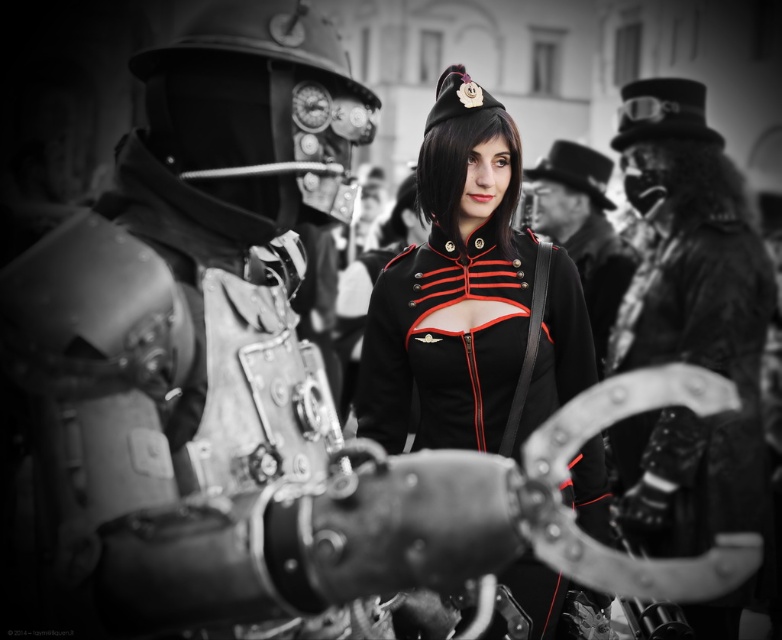
Question: Is black matte uniform at center wider than fur coat at right?

Choices:
 (A) yes
 (B) no

Answer: (A)

Question: Which is nearer to the black matte uniform at center?

Choices:
 (A) black leather jacket at center
 (B) fur coat at right

Answer: (B)

Question: Is fur coat at right bigger than black leather jacket at center?

Choices:
 (A) no
 (B) yes

Answer: (A)

Question: Estimate the real-world distances between objects in this image. Which object is farther from the fur coat at right?

Choices:
 (A) black leather jacket at center
 (B) black matte uniform at center

Answer: (A)

Question: Is black matte uniform at center above fur coat at right?

Choices:
 (A) no
 (B) yes

Answer: (B)

Question: Which point appears farthest from the camera in this image?

Choices:
 (A) (579, 240)
 (B) (633, 516)

Answer: (A)